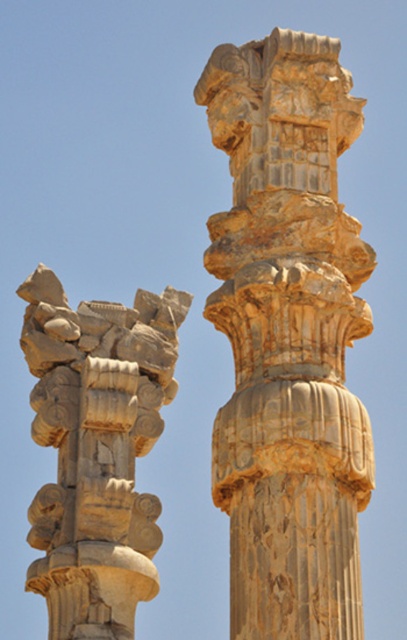
Question: Which point is farther to the camera?

Choices:
 (A) (330, 301)
 (B) (45, 410)

Answer: (B)

Question: Is golden stone column at center closer to camera compared to carved stone column at left?

Choices:
 (A) no
 (B) yes

Answer: (B)

Question: Is golden stone column at center closer to camera compared to carved stone column at left?

Choices:
 (A) yes
 (B) no

Answer: (A)

Question: Does golden stone column at center have a greater width compared to carved stone column at left?

Choices:
 (A) yes
 (B) no

Answer: (B)

Question: Which object appears farthest from the camera in this image?

Choices:
 (A) carved stone column at left
 (B) golden stone column at center

Answer: (A)